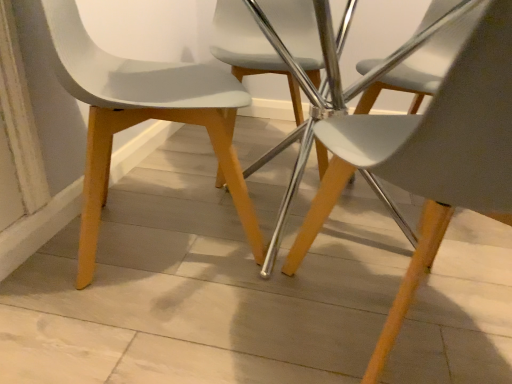
Question: Is matte white chair at left, placed as the second chair when sorted from back to front, taller than matte white chair at center, the 3th chair when ordered from front to back?

Choices:
 (A) yes
 (B) no

Answer: (A)

Question: Does matte white chair at left, placed as the second chair when sorted from back to front, appear on the right side of matte white chair at center, the 3th chair when ordered from front to back?

Choices:
 (A) no
 (B) yes

Answer: (A)

Question: Considering the relative sizes of matte white chair at left, arranged as the second chair when viewed from the front, and matte white chair at center, the 3th chair when ordered from front to back, in the image provided, is matte white chair at left, arranged as the second chair when viewed from the front, wider than matte white chair at center, the 3th chair when ordered from front to back,?

Choices:
 (A) no
 (B) yes

Answer: (B)

Question: From the image's perspective, does matte white chair at left, placed as the second chair when sorted from back to front, appear higher than matte white chair at center, which is the 1th chair in back-to-front order?

Choices:
 (A) yes
 (B) no

Answer: (B)

Question: Considering the relative sizes of matte white chair at left, arranged as the second chair when viewed from the front, and matte white chair at center, the 3th chair when ordered from front to back, in the image provided, is matte white chair at left, arranged as the second chair when viewed from the front, bigger than matte white chair at center, the 3th chair when ordered from front to back,?

Choices:
 (A) no
 (B) yes

Answer: (B)

Question: Is point (463, 66) positioned closer to the camera than point (313, 56)?

Choices:
 (A) closer
 (B) farther

Answer: (A)

Question: From their relative heights in the image, would you say white matte plastic chair at center, the 1th chair in the front-to-back sequence, is taller or shorter than matte white chair at center, the 3th chair when ordered from front to back?

Choices:
 (A) short
 (B) tall

Answer: (B)

Question: Considering the relative positions of white matte plastic chair at center, the 1th chair in the front-to-back sequence, and matte white chair at center, the 3th chair when ordered from front to back, in the image provided, is white matte plastic chair at center, the 1th chair in the front-to-back sequence, to the left or to the right of matte white chair at center, the 3th chair when ordered from front to back,?

Choices:
 (A) right
 (B) left

Answer: (A)

Question: Is white matte plastic chair at center, the 3th chair when ordered from back to front, inside or outside of matte white chair at center, the 3th chair when ordered from front to back?

Choices:
 (A) outside
 (B) inside

Answer: (A)

Question: In the image, is matte white chair at left, placed as the second chair when sorted from back to front, on the left side or the right side of white matte plastic chair at center, the 1th chair in the front-to-back sequence?

Choices:
 (A) right
 (B) left

Answer: (B)

Question: From a real-world perspective, is matte white chair at left, placed as the second chair when sorted from back to front, positioned above or below white matte plastic chair at center, the 1th chair in the front-to-back sequence?

Choices:
 (A) below
 (B) above

Answer: (A)

Question: From the image's perspective, is matte white chair at left, placed as the second chair when sorted from back to front, above or below white matte plastic chair at center, the 3th chair when ordered from back to front?

Choices:
 (A) below
 (B) above

Answer: (B)

Question: In the image, is matte white chair at left, placed as the second chair when sorted from back to front, positioned in front of or behind white matte plastic chair at center, the 1th chair in the front-to-back sequence?

Choices:
 (A) front
 (B) behind

Answer: (B)

Question: Relative to matte white chair at left, arranged as the second chair when viewed from the front, is white matte plastic chair at center, the 1th chair in the front-to-back sequence, in front or behind?

Choices:
 (A) behind
 (B) front

Answer: (B)

Question: From a real-world perspective, is white matte plastic chair at center, the 3th chair when ordered from back to front, physically located above or below matte white chair at left, arranged as the second chair when viewed from the front?

Choices:
 (A) below
 (B) above

Answer: (B)